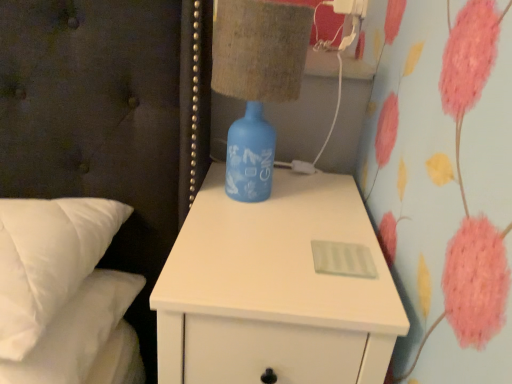
Where is `white plastic electric outlet at upper right`? Image resolution: width=512 pixels, height=384 pixels. white plastic electric outlet at upper right is located at coordinates click(351, 7).

Locate an element on the screen. The image size is (512, 384). white matte nightstand at center is located at coordinates (274, 289).

The width and height of the screenshot is (512, 384). Describe the element at coordinates (259, 50) in the screenshot. I see `blue glass bottle at upper right` at that location.

Find the location of `blue glass bottle at upper right`. blue glass bottle at upper right is located at coordinates (259, 50).

Find the location of a particular element. white plastic electric outlet at upper right is located at coordinates (351, 7).

From a real-world perspective, which object rests below the other?

blue glass bottle at upper right is physically lower.

Does white plastic electric outlet at upper right have a greater height compared to blue glass bottle at upper right?

No.

Could you tell me if white plastic electric outlet at upper right is facing blue glass bottle at upper right?

No, white plastic electric outlet at upper right does not turn towards blue glass bottle at upper right.

Considering the relative sizes of white plastic electric outlet at upper right and blue glass bottle at upper right in the image provided, is white plastic electric outlet at upper right bigger than blue glass bottle at upper right?

No.

Based on the photo, is white matte nightstand at center spatially inside white plastic electric outlet at upper right, or outside of it?

white matte nightstand at center is spatially situated outside white plastic electric outlet at upper right.

Between white matte nightstand at center and white plastic electric outlet at upper right, which one has more height?

white matte nightstand at center is taller.

In the scene shown: Which is behind, white matte nightstand at center or white plastic electric outlet at upper right?

white plastic electric outlet at upper right is more distant.

Is white matte nightstand at center looking in the opposite direction of white plastic electric outlet at upper right?

white matte nightstand at center is not turned away from white plastic electric outlet at upper right.

In the scene shown: Is blue glass bottle at upper right thinner than white plastic electric outlet at upper right?

Incorrect, the width of blue glass bottle at upper right is not less than that of white plastic electric outlet at upper right.

Is blue glass bottle at upper right taller than white plastic electric outlet at upper right?

Yes, blue glass bottle at upper right is taller than white plastic electric outlet at upper right.

In the scene shown: Which is closer to the camera, (243, 92) or (365, 3)?

Point (243, 92) is closer to the camera than point (365, 3).

Can you confirm if white plastic electric outlet at upper right is taller than white soft pillows at left?

In fact, white plastic electric outlet at upper right may be shorter than white soft pillows at left.

Considering their positions, is white plastic electric outlet at upper right located in front of or behind white soft pillows at left?

white plastic electric outlet at upper right is behind white soft pillows at left.

Between white plastic electric outlet at upper right and white soft pillows at left, which one appears on the right side from the viewer's perspective?

white plastic electric outlet at upper right.

From the image's perspective, is white plastic electric outlet at upper right located above white soft pillows at left?

Yes, from the image's perspective, white plastic electric outlet at upper right is above white soft pillows at left.

From the image's perspective, is white soft pillows at left under white plastic electric outlet at upper right?

Yes.

Measure the distance from white soft pillows at left to white plastic electric outlet at upper right.

90.21 centimeters.

Between white soft pillows at left and white plastic electric outlet at upper right, which one appears on the right side from the viewer's perspective?

white plastic electric outlet at upper right.

Is blue glass bottle at upper right directly adjacent to white matte nightstand at center?

No.

Which object is further away from the camera taking this photo, blue glass bottle at upper right or white matte nightstand at center?

blue glass bottle at upper right is further away from the camera.

From the picture: Which of these two, blue glass bottle at upper right or white matte nightstand at center, stands shorter?

With less height is blue glass bottle at upper right.

From the image's perspective, is blue glass bottle at upper right located above or below white matte nightstand at center?

From the image's perspective, blue glass bottle at upper right appears above white matte nightstand at center.

Is white soft pillows at left inside white matte nightstand at center?

Actually, white soft pillows at left is outside white matte nightstand at center.

Can you confirm if white matte nightstand at center is smaller than white soft pillows at left?

Incorrect, white matte nightstand at center is not smaller in size than white soft pillows at left.

Is the depth of white matte nightstand at center less than that of white soft pillows at left?

No, it is behind white soft pillows at left.

What's the angular difference between white matte nightstand at center and white soft pillows at left's facing directions?

The angular difference between white matte nightstand at center and white soft pillows at left is 3.6 degrees.

Identify the location of electric outlet above the blue glass bottle at upper right (from the image's perspective). The height and width of the screenshot is (384, 512). (351, 7).

Locate an element on the screen. Image resolution: width=512 pixels, height=384 pixels. electric outlet lying behind the white matte nightstand at center is located at coordinates (x=351, y=7).

Which object lies further to the anchor point white matte nightstand at center, blue glass bottle at upper right or white soft pillows at left?

Based on the image, white soft pillows at left appears to be further to white matte nightstand at center.

From the image, which object appears to be farther from blue glass bottle at upper right, white matte nightstand at center or white soft pillows at left?

white soft pillows at left.

Looking at the image, which one is located further to white plastic electric outlet at upper right, blue glass bottle at upper right or white matte nightstand at center?

Based on the image, white matte nightstand at center appears to be further to white plastic electric outlet at upper right.

Estimate the real-world distances between objects in this image. Which object is closer to white soft pillows at left, white matte nightstand at center or white plastic electric outlet at upper right?

white matte nightstand at center lies closer to white soft pillows at left than the other object.

Considering their positions, is blue glass bottle at upper right positioned further to white soft pillows at left than white matte nightstand at center?

blue glass bottle at upper right is further to white soft pillows at left.

Based on their spatial positions, is blue glass bottle at upper right or white plastic electric outlet at upper right further from white soft pillows at left?

Based on the image, white plastic electric outlet at upper right appears to be further to white soft pillows at left.

From the image, which object appears to be farther from blue glass bottle at upper right, white plastic electric outlet at upper right or white matte nightstand at center?

white plastic electric outlet at upper right lies further to blue glass bottle at upper right than the other object.

Estimate the real-world distances between objects in this image. Which object is closer to white plastic electric outlet at upper right, white matte nightstand at center or blue glass bottle at upper right?

blue glass bottle at upper right is positioned closer to the anchor white plastic electric outlet at upper right.

Where is `table lamp that lies between white plastic electric outlet at upper right and white matte nightstand at center from top to bottom`? The height and width of the screenshot is (384, 512). table lamp that lies between white plastic electric outlet at upper right and white matte nightstand at center from top to bottom is located at coordinates (259, 50).

Image resolution: width=512 pixels, height=384 pixels. Identify the location of bed between white plastic electric outlet at upper right and white matte nightstand at center in the vertical direction. (64, 294).

The width and height of the screenshot is (512, 384). Identify the location of table lamp between white soft pillows at left and white plastic electric outlet at upper right from front to back. (259, 50).

You are a GUI agent. You are given a task and a screenshot of the screen. Output one action in this format:
    pyautogui.click(x=<x>, y=<y>)
    Task: Click on the bed between blue glass bottle at upper right and white matte nightstand at center in the vertical direction
    
    Given the screenshot: What is the action you would take?
    pyautogui.click(x=64, y=294)